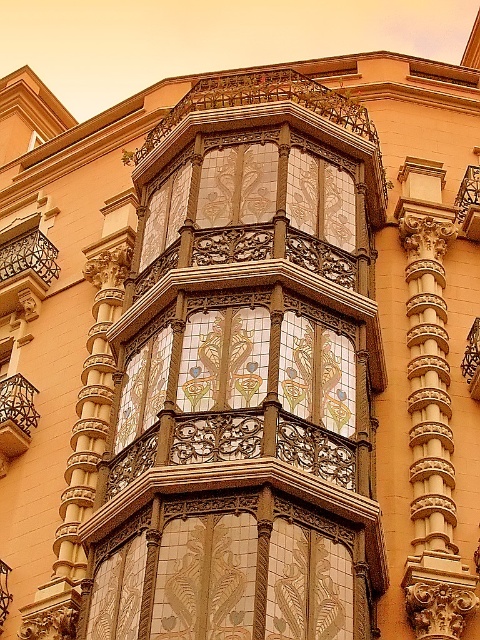
Based on the scene description, what object is located at the coordinates point [24,266]?

The black wrought iron balcony at upper left is located at point [24,266].

You are a window washer standing on the ground floor of the building. You need to clean both the black wrought iron balcony at upper left and the black wrought iron balcony at center. Given that your ladder can reach up to 40 feet, can you safely reach both balconies with a single ladder setup?

The black wrought iron balcony at upper left and black wrought iron balcony at center are 39.95 feet apart from each other. Since the ladder can reach up to 40 feet, you can safely reach both balconies with a single ladder setup as the distance between them is just under the ladder capacity.